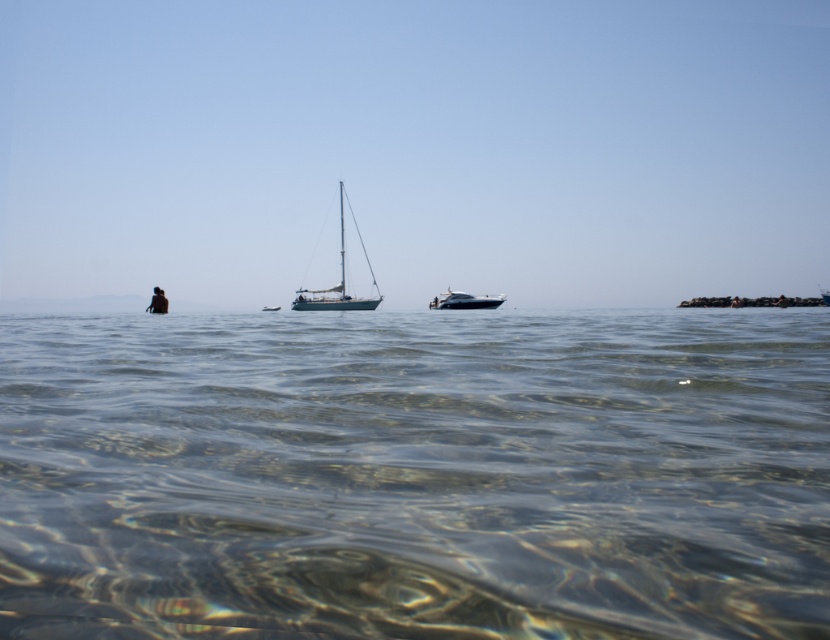
You are a drone operator trying to capture a photo of the clear water at center from above. Based on the scene description, what is the exact coordinate where you should focus your camera?

The clear water at center is located at point (415,474), so you should focus your camera at those coordinates to capture it.

You are a photographer positioned at the origin point of the image. You want to capture a photo of the white glossy sailboat at center. What are the coordinates of the sailboat relative to your position?

The coordinates of the white glossy sailboat at center are at point (x=335, y=285) relative to the photographer positioned at the origin point.